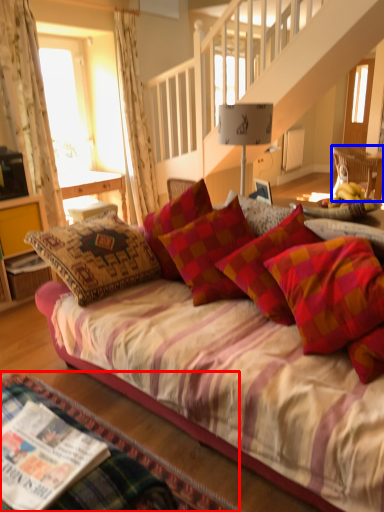
Question: Which point is further to the camera, bed frame (highlighted by a red box) or chair (highlighted by a blue box)?

Choices:
 (A) bed frame
 (B) chair

Answer: (B)